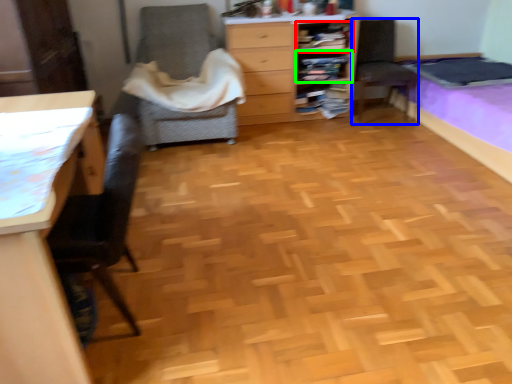
Question: Considering the real-world distances, which object is closest to shelf (highlighted by a red box)? chair (highlighted by a blue box) or shelf (highlighted by a green box).

Choices:
 (A) chair
 (B) shelf

Answer: (B)